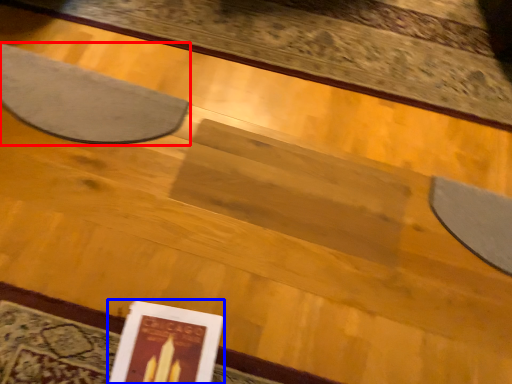
Question: Which point is further to the camera, mat (highlighted by a red box) or paperback book (highlighted by a blue box)?

Choices:
 (A) mat
 (B) paperback book

Answer: (A)